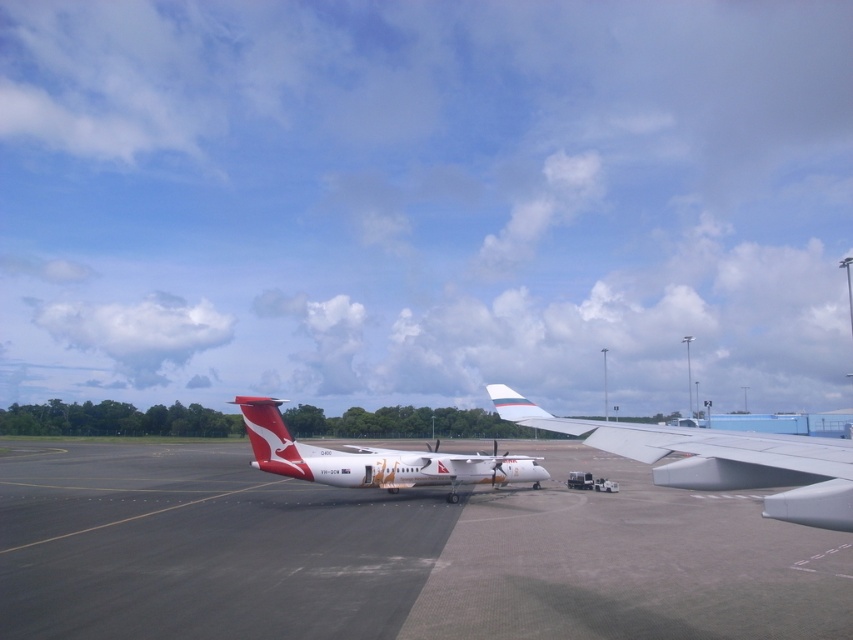
Question: Which point is farther to the camera?

Choices:
 (A) (256, 460)
 (B) (445, 458)
 (C) (706, 433)

Answer: (B)

Question: Is smooth asphalt tarmac at center bigger than white glossy airplane at center?

Choices:
 (A) yes
 (B) no

Answer: (A)

Question: Considering the relative positions of smooth asphalt tarmac at center and polished red tail at center in the image provided, where is smooth asphalt tarmac at center located with respect to polished red tail at center?

Choices:
 (A) above
 (B) below

Answer: (B)

Question: Can you confirm if smooth asphalt tarmac at center is wider than white glossy wing at center?

Choices:
 (A) yes
 (B) no

Answer: (A)

Question: Estimate the real-world distances between objects in this image. Which object is closer to the white glossy wing at center?

Choices:
 (A) smooth asphalt tarmac at center
 (B) polished red tail at center

Answer: (B)

Question: Estimate the real-world distances between objects in this image. Which object is farther from the smooth asphalt tarmac at center?

Choices:
 (A) white glossy wing at center
 (B) polished red tail at center
 (C) white glossy airplane at center

Answer: (A)